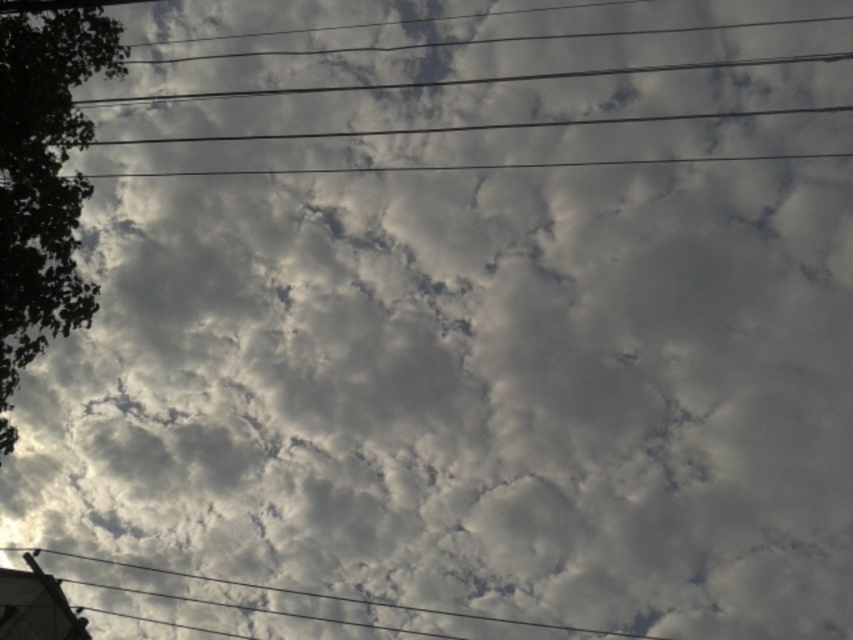
Question: Which object is positioned closest to the green leafy tree at left?

Choices:
 (A) smooth gray telegraph pole at bottom left
 (B) black wire at lower left

Answer: (A)

Question: Considering the real-world distances, which object is farthest from the black wire at lower left?

Choices:
 (A) green leafy tree at left
 (B) smooth gray telegraph pole at bottom left

Answer: (A)

Question: Where is green leafy tree at left located in relation to smooth gray telegraph pole at bottom left in the image?

Choices:
 (A) left
 (B) right

Answer: (B)

Question: Can you confirm if black wire at lower left is positioned above smooth gray telegraph pole at bottom left?

Choices:
 (A) no
 (B) yes

Answer: (A)

Question: Which point is closer to the camera?

Choices:
 (A) black wire at lower left
 (B) smooth gray telegraph pole at bottom left

Answer: (B)

Question: Is black wire at lower left smaller than smooth gray telegraph pole at bottom left?

Choices:
 (A) yes
 (B) no

Answer: (B)